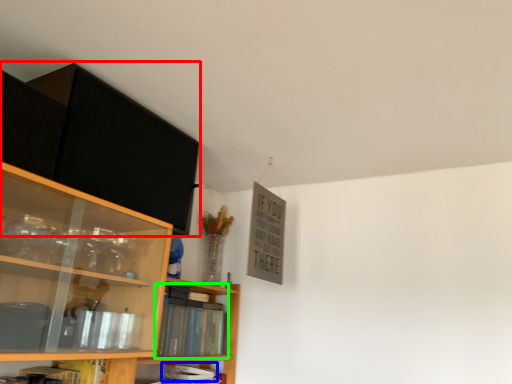
Question: Which is nearer to the cabinetry (highlighted by a red box)? book (highlighted by a blue box) or book (highlighted by a green box).

Choices:
 (A) book
 (B) book

Answer: (B)